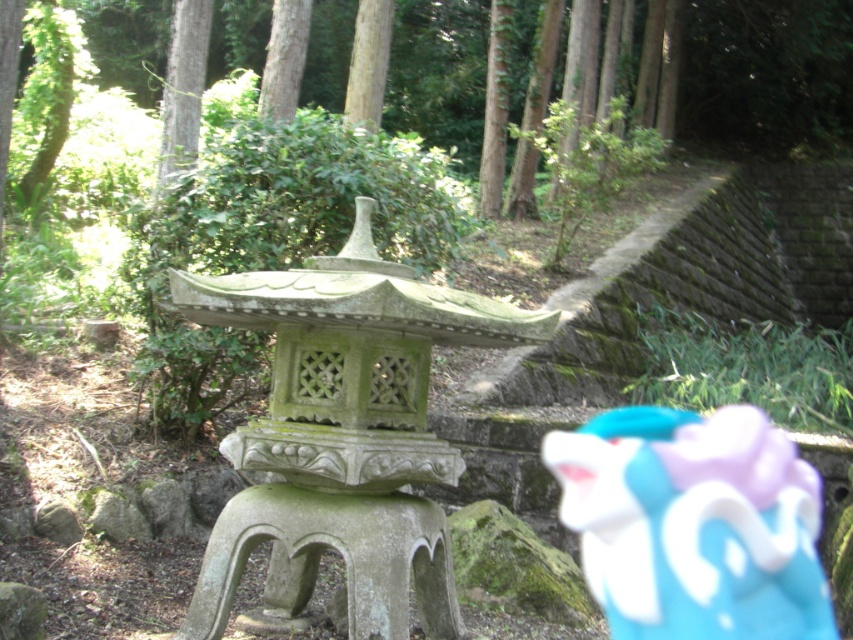
You are a hiker who wants to take a break in the forest. You see a green stone stool at center and a smooth bark tree at upper center. Which object would provide shade if the sun is directly overhead?

The smooth bark tree at upper center would provide shade because the green stone stool at center is positioned under it.

You are a visitor in a Japanese garden and want to sit on the green stone stool at center. To your left, there is a smooth bark tree at upper center. Which direction should you face to have the tree behind you while sitting?

The green stone stool at center is positioned on the right side of smooth bark tree at upper center. Therefore, if you sit on the green stone stool at center and face away from the tree, the smooth bark tree at upper center will be behind you.

You are a child playing in the forest and you see the matte plastic toy at center and the smooth brown tree trunk at upper center. Which object is closer to the ground?

The matte plastic toy at center is closer to the ground because it is positioned under the smooth brown tree trunk at upper center.